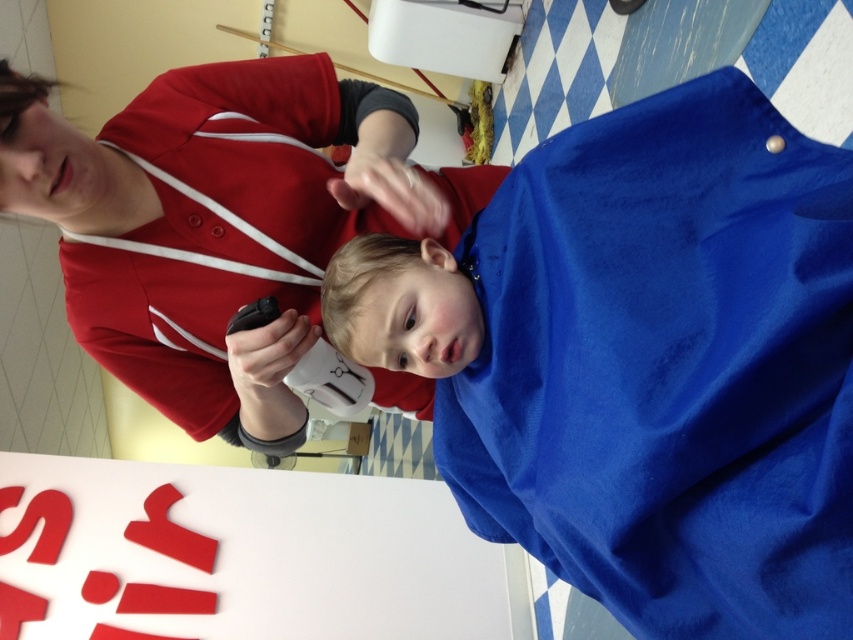
Question: Is the position of blue fabric at center less distant than that of smooth blue towel at center?

Choices:
 (A) yes
 (B) no

Answer: (A)

Question: Is blue fabric at center bigger than smooth blue towel at center?

Choices:
 (A) no
 (B) yes

Answer: (A)

Question: Which of the following is the closest to the observer?

Choices:
 (A) blue fabric at center
 (B) smooth blue towel at center

Answer: (A)

Question: Can you confirm if blue fabric at center is bigger than smooth blue towel at center?

Choices:
 (A) yes
 (B) no

Answer: (B)